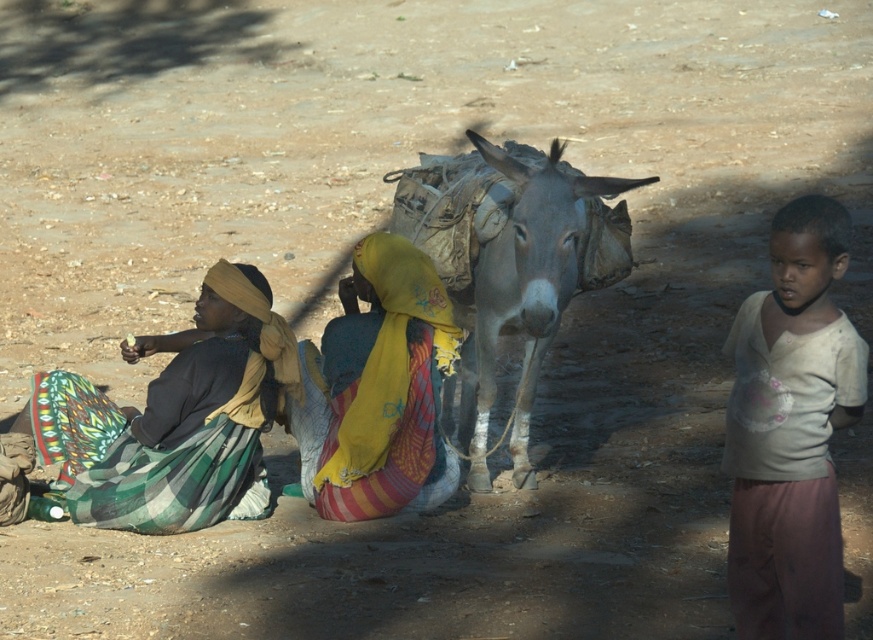
Question: From the image, what is the correct spatial relationship of light beige cotton shirt at right in relation to gray textured donkey at center?

Choices:
 (A) right
 (B) left

Answer: (A)

Question: Which point is farther to the camera?

Choices:
 (A) yellow fabric headscarf at center
 (B) matte yellow headscarf at left
 (C) gray textured donkey at center

Answer: (A)

Question: Which point appears closest to the camera in this image?

Choices:
 (A) (562, 307)
 (B) (400, 321)
 (C) (232, 288)
 (D) (820, 554)

Answer: (D)

Question: Which of these objects is positioned closest to the gray textured donkey at center?

Choices:
 (A) light beige cotton shirt at right
 (B) yellow fabric headscarf at center
 (C) matte yellow headscarf at left

Answer: (B)

Question: Can you confirm if light beige cotton shirt at right is wider than gray textured donkey at center?

Choices:
 (A) yes
 (B) no

Answer: (B)

Question: Is gray textured donkey at center smaller than yellow fabric headscarf at center?

Choices:
 (A) no
 (B) yes

Answer: (A)